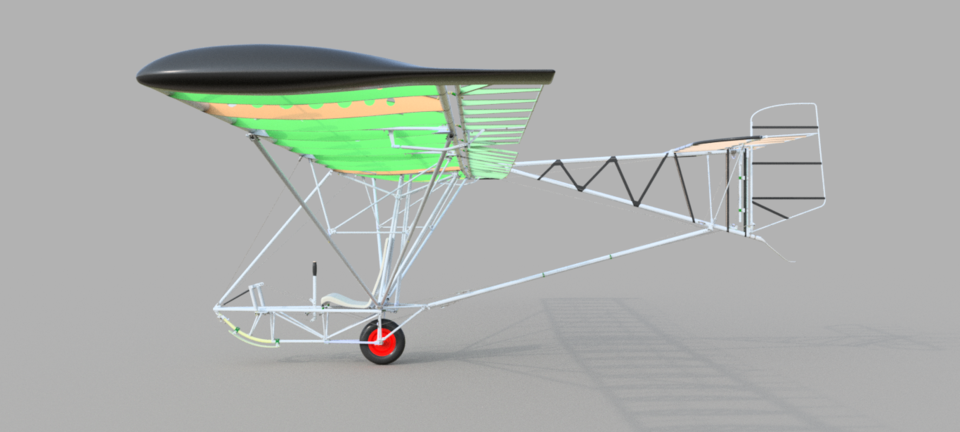
The image size is (960, 432). Find the location of `seat`. seat is located at coordinates (343, 300).